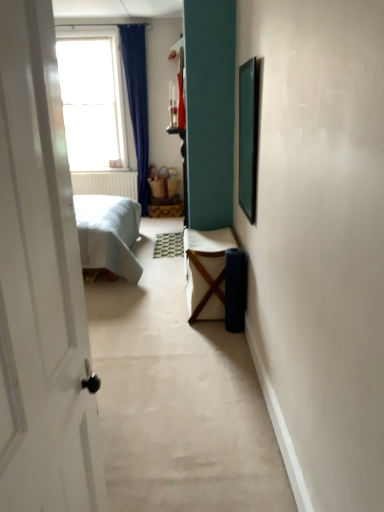
Question: In terms of width, does white fabric chair at center look wider or thinner when compared to green matte picture frame at upper right?

Choices:
 (A) thin
 (B) wide

Answer: (B)

Question: In terms of height, does white fabric chair at center look taller or shorter compared to green matte picture frame at upper right?

Choices:
 (A) short
 (B) tall

Answer: (A)

Question: Considering the real-world distances, which object is closest to the white fabric chair at center?

Choices:
 (A) transparent glass window at upper left
 (B) green matte picture frame at upper right

Answer: (B)

Question: Estimate the real-world distances between objects in this image. Which object is farther from the green matte picture frame at upper right?

Choices:
 (A) white fabric chair at center
 (B) transparent glass window at upper left

Answer: (B)